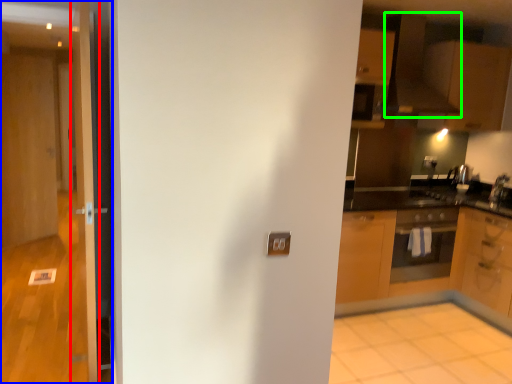
Question: Which object is positioned closest to door (highlighted by a red box)? Select from door (highlighted by a blue box) and exhaust hood (highlighted by a green box).

Choices:
 (A) door
 (B) exhaust hood

Answer: (A)